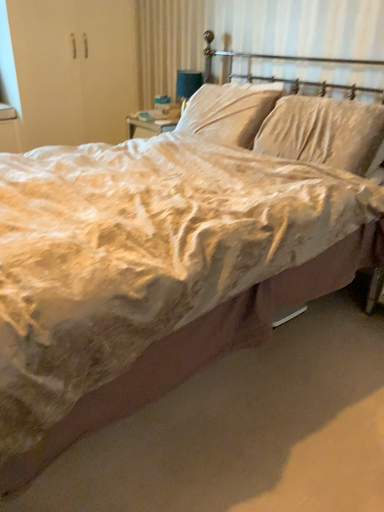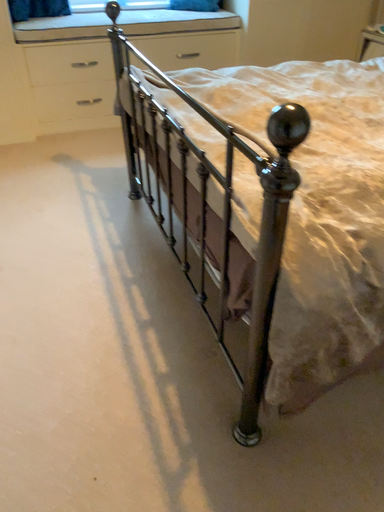
Question: Which way did the camera rotate in the video?

Choices:
 (A) rotated right
 (B) rotated left

Answer: (B)